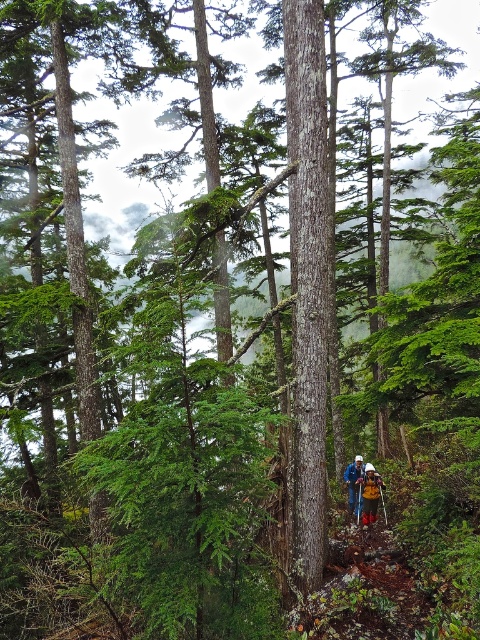
Question: Which of the following is the farthest from the observer?

Choices:
 (A) (348, 490)
 (B) (368, 496)

Answer: (A)

Question: Which of the following is the farthest from the observer?

Choices:
 (A) (360, 486)
 (B) (379, 486)

Answer: (A)

Question: Does yellow fabric backpack at center have a smaller size compared to camouflage jacket at lower center?

Choices:
 (A) no
 (B) yes

Answer: (B)

Question: Is yellow fabric backpack at center bigger than camouflage jacket at lower center?

Choices:
 (A) yes
 (B) no

Answer: (B)

Question: Is the position of yellow fabric backpack at center less distant than that of camouflage jacket at lower center?

Choices:
 (A) no
 (B) yes

Answer: (B)